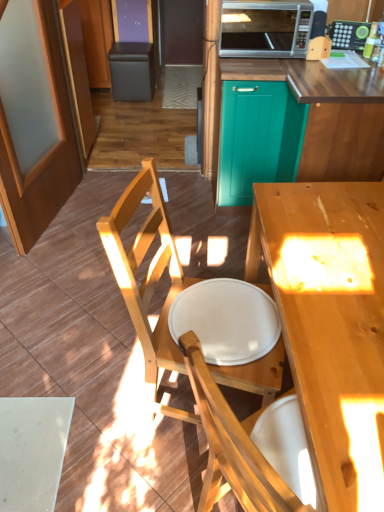
At what (x,y) coordinates should I click in order to perform the action: click on vacant space to the right of wooden screen door at left, the first screen door positioned from the left. Please return your answer as a coordinate pair (x, y). This screenshot has height=512, width=384. Looking at the image, I should click on (137, 208).